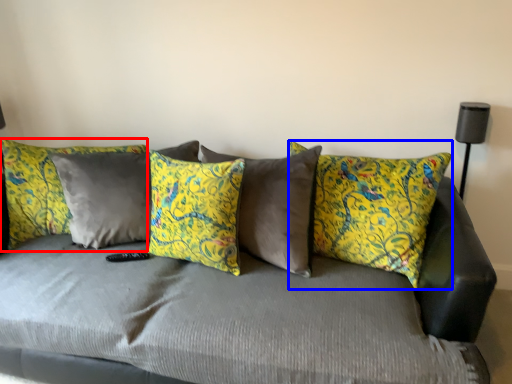
Question: Which point is further to the camera, pillow (highlighted by a red box) or pillow (highlighted by a blue box)?

Choices:
 (A) pillow
 (B) pillow

Answer: (A)